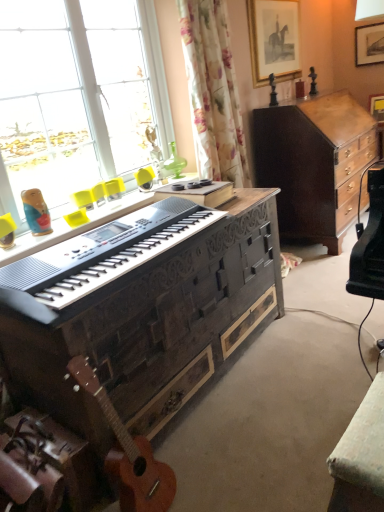
Where is `black textured piano at center`? This screenshot has height=512, width=384. black textured piano at center is located at coordinates (98, 257).

This screenshot has width=384, height=512. What do you see at coordinates (369, 44) in the screenshot? I see `wooden picture frame at upper right, which appears as the first picture frame when viewed from the right` at bounding box center [369, 44].

At what (x,y) coordinates should I click in order to perform the action: click on orange wood guitar at lower left. Please return your answer as a coordinate pair (x, y). This screenshot has height=512, width=384. Looking at the image, I should click on (128, 454).

What do you see at coordinates (77, 96) in the screenshot? I see `transparent glass window at upper left` at bounding box center [77, 96].

Identify the location of wooden framed picture at upper right, which is the second picture frame from back to front. The image size is (384, 512). (273, 40).

Is dark wood cabinet at center right at the left side of wooden framed picture at upper right, the 2th picture frame in the right-to-left sequence?

No, dark wood cabinet at center right is not to the left of wooden framed picture at upper right, the 2th picture frame in the right-to-left sequence.

Can you confirm if dark wood cabinet at center right is taller than wooden framed picture at upper right, which is the second picture frame from back to front?

Yes.

Is dark wood cabinet at center right thinner than wooden framed picture at upper right, the 2th picture frame in the right-to-left sequence?

Incorrect, the width of dark wood cabinet at center right is not less than that of wooden framed picture at upper right, the 2th picture frame in the right-to-left sequence.

Which object is closer to the camera taking this photo, dark wood cabinet at center right or wooden framed picture at upper right, which is the 1th picture frame from front to back?

dark wood cabinet at center right is closer to the camera.

From a real-world perspective, is black textured piano at center over dark wood cabinet at center right?

Correct, in the physical world, black textured piano at center is higher than dark wood cabinet at center right.

From the image's perspective, does black textured piano at center appear higher than dark wood cabinet at center right?

No.

Considering the relative sizes of black textured piano at center and dark wood cabinet at center right in the image provided, is black textured piano at center shorter than dark wood cabinet at center right?

Correct, black textured piano at center is not as tall as dark wood cabinet at center right.

Is black textured piano at center looking in the opposite direction of dark wood cabinet at center right?

No, black textured piano at center is not facing away from dark wood cabinet at center right.

Which point is more distant from viewer, (184, 310) or (279, 46)?

The point (279, 46) is farther.

Is woodendesk at center facing towards wooden framed picture at upper right, which is the second picture frame from back to front?

No, woodendesk at center is not oriented towards wooden framed picture at upper right, which is the second picture frame from back to front.

In the image, is woodendesk at center positioned in front of or behind wooden framed picture at upper right, the 2th picture frame in the right-to-left sequence?

woodendesk at center is in front of wooden framed picture at upper right, the 2th picture frame in the right-to-left sequence.

Considering the relative sizes of woodendesk at center and wooden framed picture at upper right, which is the second picture frame from back to front, in the image provided, is woodendesk at center thinner than wooden framed picture at upper right, which is the second picture frame from back to front,?

No, woodendesk at center is not thinner than wooden framed picture at upper right, which is the second picture frame from back to front.

Is wooden framed picture at upper right, which is the 1th picture frame from front to back, positioned in front of orange wood guitar at lower left?

No, wooden framed picture at upper right, which is the 1th picture frame from front to back, is behind orange wood guitar at lower left.

Looking at their sizes, would you say wooden framed picture at upper right, marked as the 1th picture frame in a left-to-right arrangement, is wider or thinner than orange wood guitar at lower left?

Considering their sizes, wooden framed picture at upper right, marked as the 1th picture frame in a left-to-right arrangement, looks slimmer than orange wood guitar at lower left.

Consider the image. Considering the relative positions of wooden framed picture at upper right, the 2th picture frame in the right-to-left sequence, and orange wood guitar at lower left in the image provided, is wooden framed picture at upper right, the 2th picture frame in the right-to-left sequence, to the right of orange wood guitar at lower left from the viewer's perspective?

Yes.

In the image, is wooden picture frame at upper right, which is the first picture frame in back-to-front order, positioned in front of or behind wooden framed picture at upper right, the 2th picture frame in the right-to-left sequence?

wooden picture frame at upper right, which is the first picture frame in back-to-front order, is positioned farther from the viewer than wooden framed picture at upper right, the 2th picture frame in the right-to-left sequence.

Is wooden picture frame at upper right, the 2th picture frame viewed from the front, directly adjacent to wooden framed picture at upper right, which is the second picture frame from back to front?

No.

Is wooden picture frame at upper right, which is the second picture frame in left-to-right order, wider than wooden framed picture at upper right, which is the 1th picture frame from front to back?

No.

From a real-world perspective, is wooden picture frame at upper right, which is the first picture frame in back-to-front order, physically located above or below wooden framed picture at upper right, the 2th picture frame in the right-to-left sequence?

wooden picture frame at upper right, which is the first picture frame in back-to-front order, is below wooden framed picture at upper right, the 2th picture frame in the right-to-left sequence.

Is orange wood guitar at lower left touching dark wood cabinet at center right?

orange wood guitar at lower left is not next to dark wood cabinet at center right, and they're not touching.

How many degrees apart are the facing directions of orange wood guitar at lower left and dark wood cabinet at center right?

2.63 degrees separate the facing orientations of orange wood guitar at lower left and dark wood cabinet at center right.

Is orange wood guitar at lower left facing towards dark wood cabinet at center right?

No.

From the image's perspective, would you say orange wood guitar at lower left is positioned over dark wood cabinet at center right?

No.

Is wooden picture frame at upper right, which is the second picture frame in left-to-right order, directly adjacent to woodendesk at center?

wooden picture frame at upper right, which is the second picture frame in left-to-right order, and woodendesk at center are not in contact.

From the image's perspective, is wooden picture frame at upper right, the 2th picture frame viewed from the front, located above or below woodendesk at center?

Based on their image positions, wooden picture frame at upper right, the 2th picture frame viewed from the front, is located above woodendesk at center.

The width and height of the screenshot is (384, 512). Identify the location of desk in front of the wooden picture frame at upper right, the 2th picture frame viewed from the front. (132, 335).

Does wooden picture frame at upper right, the 2th picture frame viewed from the front, appear on the left side of woodendesk at center?

Incorrect, wooden picture frame at upper right, the 2th picture frame viewed from the front, is not on the left side of woodendesk at center.

This screenshot has height=512, width=384. I want to click on the 1st picture frame behind the dark wood cabinet at center right, starting your count from the anchor, so click(273, 40).

At what (x,y) coordinates should I click in order to perform the action: click on cabinetry below the black textured piano at center (from a real-world perspective). Please return your answer as a coordinate pair (x, y). The height and width of the screenshot is (512, 384). Looking at the image, I should click on (314, 163).

Consider the image. Looking at the image, which one is located further to woodendesk at center, orange wood guitar at lower left or transparent glass window at upper left?

Based on the image, transparent glass window at upper left appears to be further to woodendesk at center.

When comparing their distances from wooden framed picture at upper right, marked as the 1th picture frame in a left-to-right arrangement, does black textured piano at center or transparent glass window at upper left seem further?

black textured piano at center is positioned further to the anchor wooden framed picture at upper right, marked as the 1th picture frame in a left-to-right arrangement.

Looking at this image, which object lies further to the anchor point black textured piano at center, wooden framed picture at upper right, the 2th picture frame in the right-to-left sequence, or transparent glass window at upper left?

Based on the image, wooden framed picture at upper right, the 2th picture frame in the right-to-left sequence, appears to be further to black textured piano at center.

Estimate the real-world distances between objects in this image. Which object is closer to wooden framed picture at upper right, which is the second picture frame from back to front, black textured piano at center or woodendesk at center?

woodendesk at center is positioned closer to the anchor wooden framed picture at upper right, which is the second picture frame from back to front.

Estimate the real-world distances between objects in this image. Which object is further from dark wood cabinet at center right, wooden picture frame at upper right, which appears as the first picture frame when viewed from the right, or wooden framed picture at upper right, marked as the 1th picture frame in a left-to-right arrangement?

Based on the image, wooden picture frame at upper right, which appears as the first picture frame when viewed from the right, appears to be further to dark wood cabinet at center right.

From the image, which object appears to be nearer to orange wood guitar at lower left, wooden picture frame at upper right, which is the second picture frame in left-to-right order, or black textured piano at center?

black textured piano at center.

From the image, which object appears to be nearer to dark wood cabinet at center right, wooden framed picture at upper right, the 2th picture frame in the right-to-left sequence, or woodendesk at center?

wooden framed picture at upper right, the 2th picture frame in the right-to-left sequence, lies closer to dark wood cabinet at center right than the other object.

Based on their spatial positions, is wooden picture frame at upper right, the 2th picture frame viewed from the front, or woodendesk at center further from transparent glass window at upper left?

wooden picture frame at upper right, the 2th picture frame viewed from the front, is further to transparent glass window at upper left.

Identify the location of picture frame between transparent glass window at upper left and dark wood cabinet at center right. Image resolution: width=384 pixels, height=512 pixels. (273, 40).

At what (x,y) coordinates should I click in order to perform the action: click on cabinetry located between orange wood guitar at lower left and wooden picture frame at upper right, the 2th picture frame viewed from the front, in the depth direction. Please return your answer as a coordinate pair (x, y). Looking at the image, I should click on (314, 163).

Find the location of `desk between orange wood guitar at lower left and wooden picture frame at upper right, which is the first picture frame in back-to-front order, in the front-back direction`. desk between orange wood guitar at lower left and wooden picture frame at upper right, which is the first picture frame in back-to-front order, in the front-back direction is located at coordinates (132, 335).

This screenshot has height=512, width=384. Find the location of `cabinetry between black textured piano at center and wooden picture frame at upper right, the 2th picture frame viewed from the front, in the front-back direction`. cabinetry between black textured piano at center and wooden picture frame at upper right, the 2th picture frame viewed from the front, in the front-back direction is located at coordinates (314, 163).